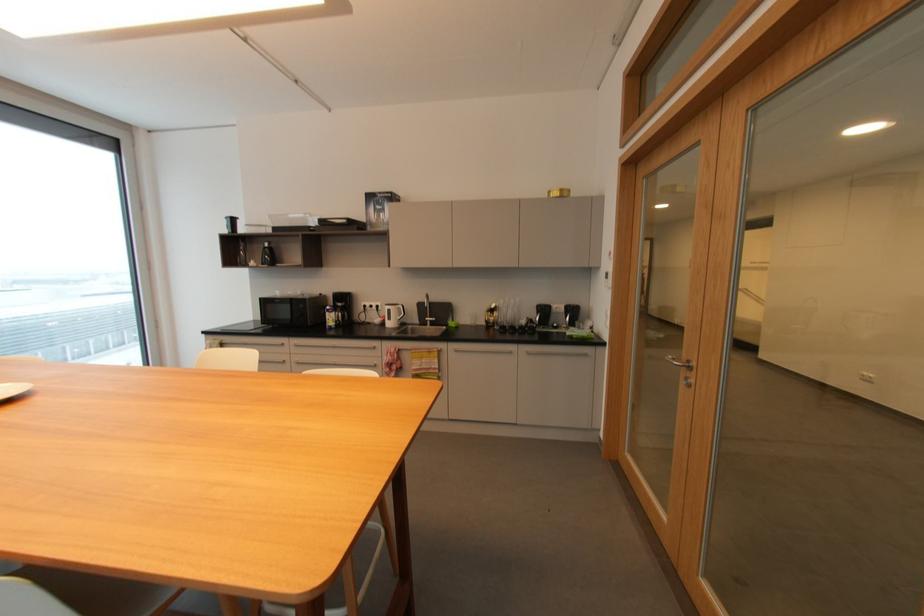
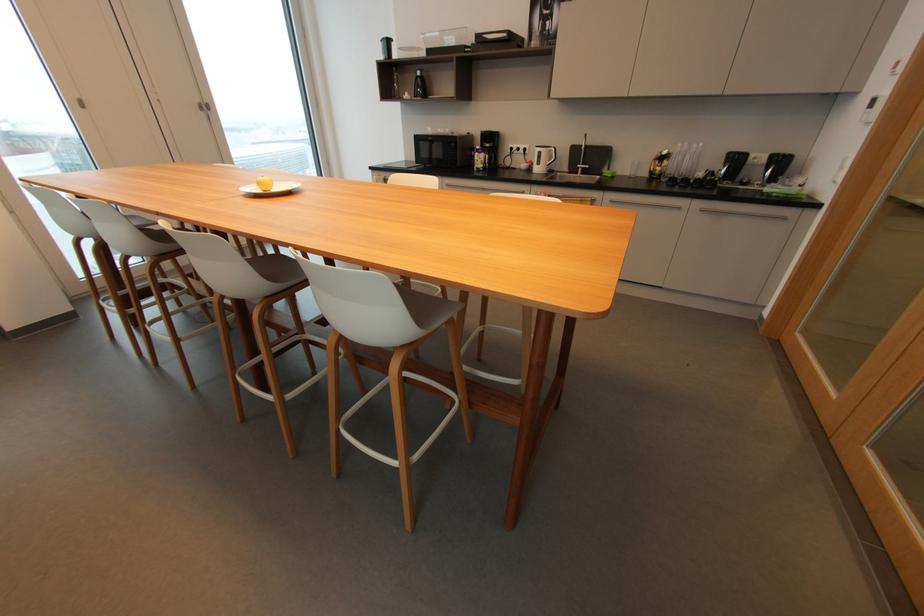
Where in the second image is the point corresponding to [271,245] from the first image?

(421, 74)